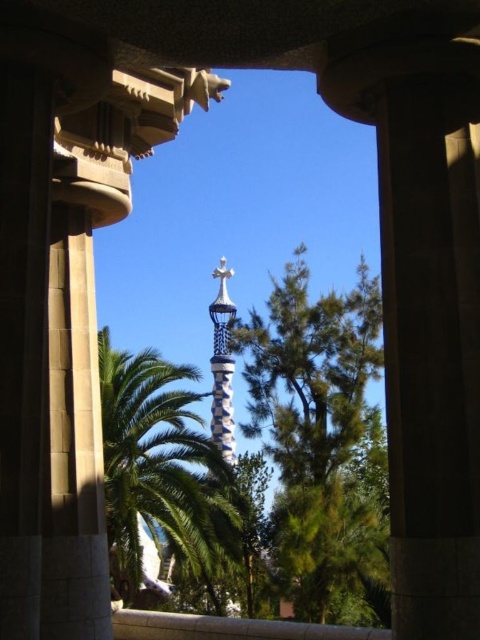
You are standing in the doorway and want to take a photo of the green leafy tree at center and the green leafy palm tree at center. Which tree will appear closer to the camera in the photo?

The green leafy tree at center will appear closer to the camera because the green leafy palm tree at center is positioned behind it.

You are standing in a modern building and looking through an architectural opening. You see a green leafy palm tree at center and a white mosaic spire at center. Which object is closer to you?

The green leafy palm tree at center is closer because it is positioned under the white mosaic spire at center, indicating it is in front of the spire.

You are standing in a modern building and looking through an architectural opening. You see a green leafy tree at center and a green leafy palm tree at center. Which one is taller?

The green leafy tree at center is taller than the green leafy palm tree at center.